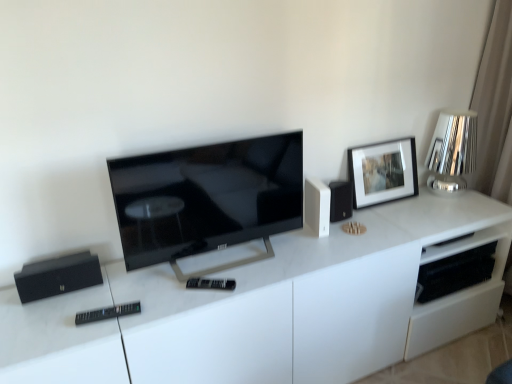
Locate an element on the screen. Image resolution: width=512 pixels, height=384 pixels. free space in front of black plastic remote at lower left, the 1th remote in the front-to-back sequence is located at coordinates (94, 340).